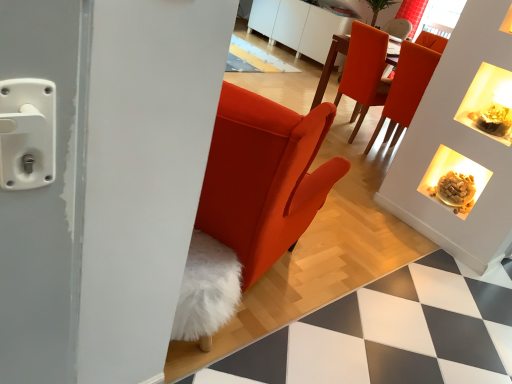
Question: Is matte white fireplace at upper right taller or shorter than matte orange chair at upper right, which appears as the first chair when viewed from the right?

Choices:
 (A) short
 (B) tall

Answer: (A)

Question: Is matte white fireplace at upper right in front of or behind matte orange chair at upper right, which appears as the first chair when viewed from the right, in the image?

Choices:
 (A) behind
 (B) front

Answer: (B)

Question: Which object is positioned closest to the matte white fireplace at upper right?

Choices:
 (A) matte orange chair at upper right, positioned as the second chair in right-to-left order
 (B) red velvet curtain at upper center
 (C) matte orange chair at upper right, which appears as the first chair when viewed from the right

Answer: (C)

Question: Which object is the closest to the matte white fireplace at upper right?

Choices:
 (A) matte orange chair at upper right, which ranks as the second chair in left-to-right order
 (B) matte orange chair at upper right, positioned as the second chair in right-to-left order
 (C) red velvet curtain at upper center

Answer: (A)